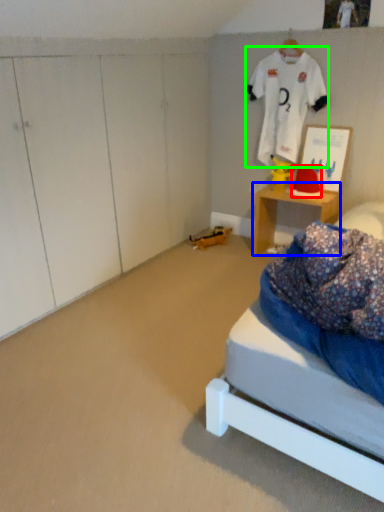
Question: Which object is positioned closest to hat (highlighted by a red box)? Select from desk (highlighted by a blue box) and clothing (highlighted by a green box).

Choices:
 (A) desk
 (B) clothing

Answer: (A)